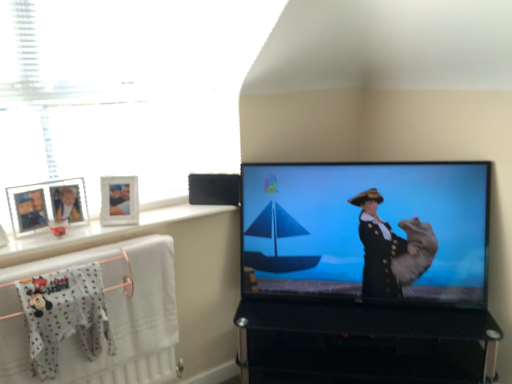
Where is `free space above white cotton onesie at lower left (from a real-world perspective)`? This screenshot has height=384, width=512. free space above white cotton onesie at lower left (from a real-world perspective) is located at coordinates (61, 269).